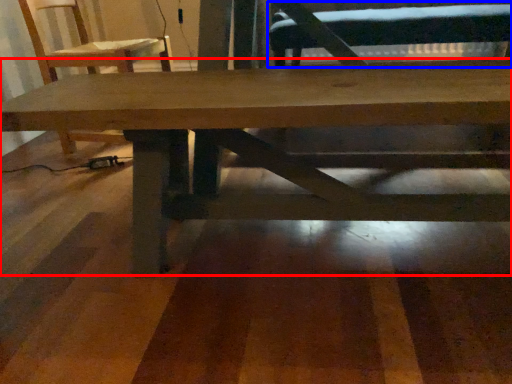
Question: Which of the following is the closest to the observer, table (highlighted by a red box) or swivel chair (highlighted by a blue box)?

Choices:
 (A) table
 (B) swivel chair

Answer: (A)